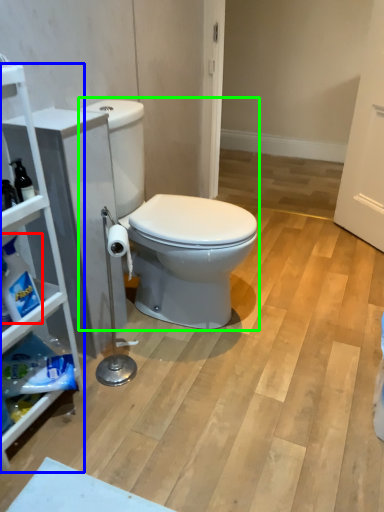
Question: Estimate the real-world distances between objects in this image. Which object is farther from cleaning product (highlighted by a red box), cabinetry (highlighted by a blue box) or toilet (highlighted by a green box)?

Choices:
 (A) cabinetry
 (B) toilet

Answer: (B)